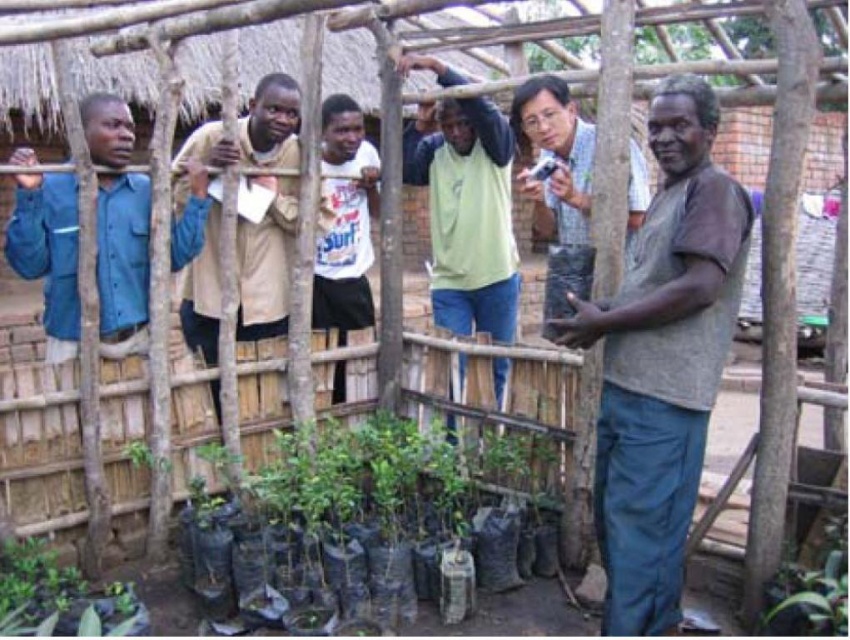
You are a gardener who needs to place a 2 meter long wooden plank between the gray matte shirt at center and the white matte shirt at center. Is there enough space between them to fit the plank?

The gray matte shirt at center and the white matte shirt at center are 2.16 meters apart, so yes, the 2 meter long wooden plank can fit between them since the distance is greater than the plank length.

You are a gardener standing at the entrance of the greenhouse structure. You need to water the green matte plant at lower center. Based on its position, can you estimate how far to the right or left you should move from your current position to reach it?

The green matte plant at lower center is located at point coordinates of 0.820 on the x and 0.399 on the y. Since the entrance is likely at the front, you would need to move to the right to reach the plant as the x coordinate is 0.820, which is towards the right side of the image.